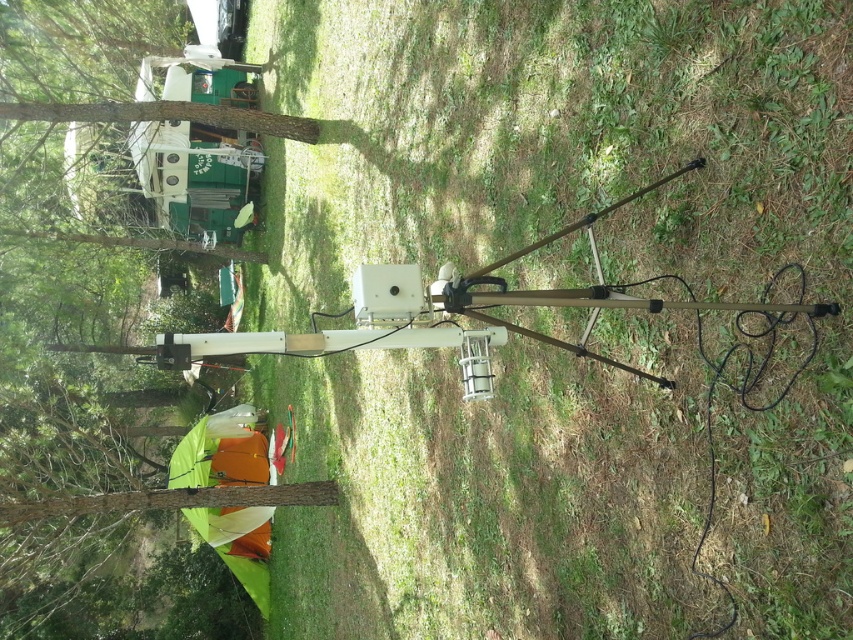
You are setting up a tent in the campsite and need to choose between placing it on the green grass at center or under the brown wood tree at left. Considering the space available, which location would allow for a larger tent?

The brown wood tree at left has more space since the green grass at center is thinner, meaning the area under the tree is wider.

You are planning to set up a tent in the campsite. The tent requires a flat area larger than the brown wood tree at left. Can the green grass at center provide enough space?

The green grass at center is bigger than the brown wood tree at left, so yes, the green grass at center can provide enough space for the tent since it is larger in size.

Based on the photo, you are a hiker who wants to set up a tent between the green grass at center and the brown wood tree at left. The tent requires at least 8 meters of space between the two points to be properly pitched. Can you safely set up your tent in this location?

The distance between the green grass at center and the brown wood tree at left is 10.47 meters, which is more than the required 8 meters. Therefore, you can safely set up your tent in this location.